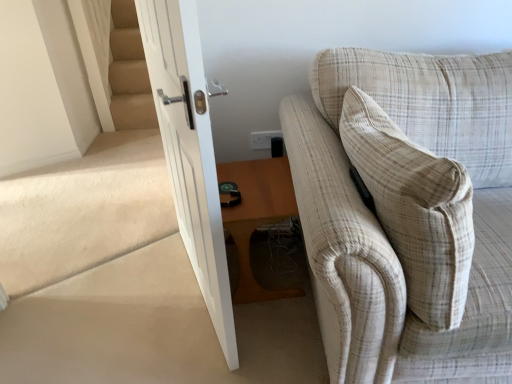
Where is `vacant area located to the right-hand side of beige carpeted stairs at left`? This screenshot has height=384, width=512. vacant area located to the right-hand side of beige carpeted stairs at left is located at coordinates (165, 275).